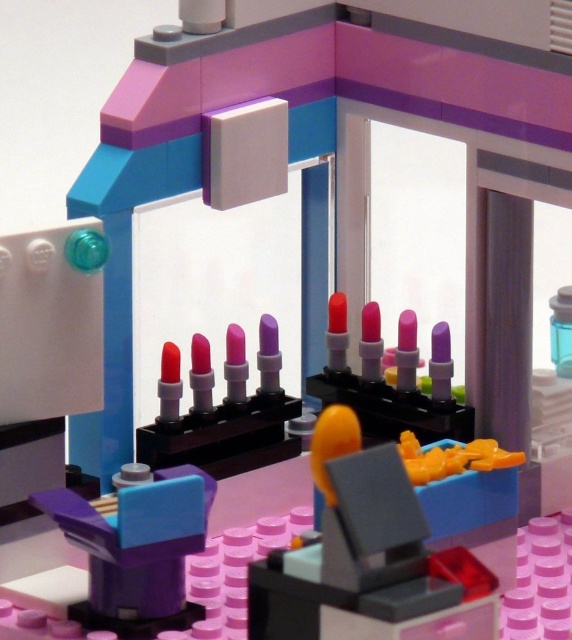
Between point (196, 436) and point (566, 358), which one is positioned in front?

Point (196, 436) is more forward.

Who is more distant from viewer, (216, 476) or (557, 314)?

Point (557, 314)

You are a GUI agent. You are given a task and a screenshot of the screen. Output one action in this format:
    pyautogui.click(x=<x>, y=<y>)
    Task: Click on the matte plastic lipsticks at center
    The width and height of the screenshot is (572, 640).
    Given the screenshot: What is the action you would take?
    pyautogui.click(x=223, y=410)

Is point (93, 566) behind point (569, 352)?

No, (93, 566) is closer to viewer.

Is point (192, 500) closer to camera compared to point (555, 346)?

Yes, it is.

At what (x,y) coordinates should I click in order to perform the action: click on purple matte box at lower left. Please return your answer as a coordinate pair (x, y). This screenshot has width=572, height=640. Looking at the image, I should click on (137, 548).

Between point (351, 493) and point (411, 404), which one is positioned in front?

Point (351, 493) is in front.

Which is more to the right, orange plastic chair at center or matte plastic lipstick at center?

matte plastic lipstick at center

Is point (289, 595) closer to camera compared to point (396, 397)?

Yes, it is.

At what (x,y) coordinates should I click in order to perform the action: click on orange plastic chair at center. Please return your answer as a coordinate pair (x, y). Looking at the image, I should click on (367, 557).